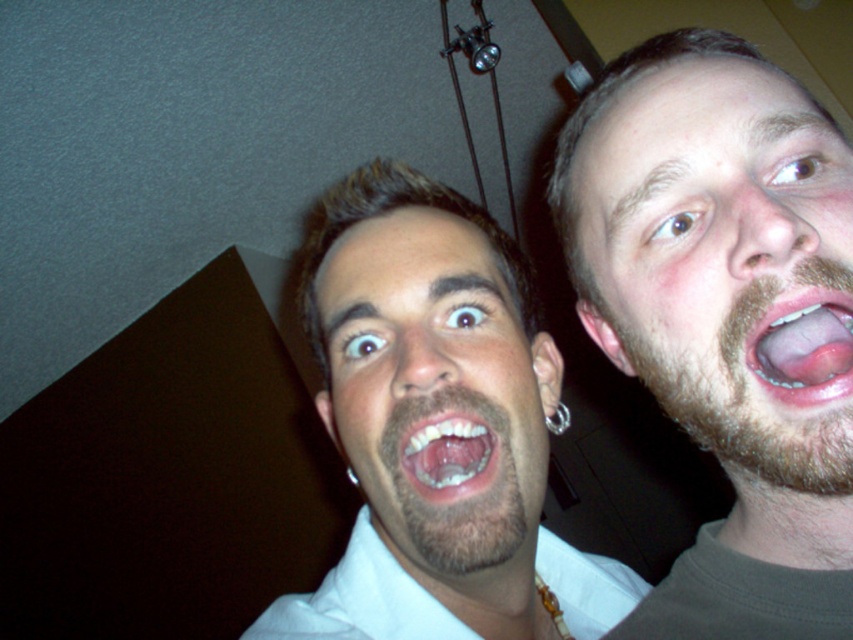
You are taking a selfie with two friends. You notice the brownhairman at center and the white glossy teeth at center in the frame. Which object is closer to the camera?

The brownhairman at center is positioned over white glossy teeth at center, meaning it is closer to the camera.

You are trying to take a selfie with two people. The two people are the brownhairman at center. How far apart should they stand to fit in the frame?

The brownhairman at center are 13.85 inches apart, so they should stand approximately 13.85 inches apart to fit in the frame.

Based on the scene description, where is the beige facial hair at upper right located in terms of coordinates?

The beige facial hair at upper right is located at coordinates point (722, 260).